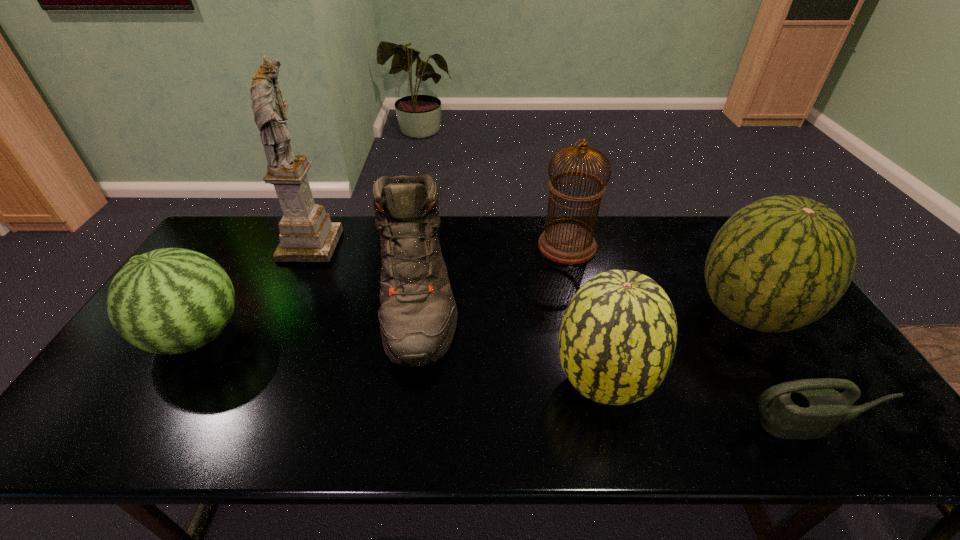
This screenshot has width=960, height=540. I want to click on sculpture, so click(306, 233).

You are a GUI agent. You are given a task and a screenshot of the screen. Output one action in this format:
    pyautogui.click(x=<x>, y=<y>)
    Task: Click on the birdcage
    The width and height of the screenshot is (960, 540).
    Given the screenshot: What is the action you would take?
    pyautogui.click(x=570, y=244)

The width and height of the screenshot is (960, 540). What are the coordinates of `ski boot` in the screenshot? It's located at (418, 315).

Locate an element on the screen. the rightmost watermelon is located at coordinates (782, 262).

Where is `the second watermelon from left to right`? the second watermelon from left to right is located at coordinates (617, 340).

Image resolution: width=960 pixels, height=540 pixels. Identify the location of the leftmost watermelon. point(172,300).

The height and width of the screenshot is (540, 960). I want to click on the shortest object, so click(x=809, y=408).

This screenshot has width=960, height=540. I want to click on vacant position located on the front-facing side of the tallest object, so click(x=372, y=245).

Identify the location of vacant space located on the front-facing side of the birdcage. The image size is (960, 540). (481, 246).

At what (x,y) coordinates should I click in order to perform the action: click on vacant position located 0.140m on the front-facing side of the birdcage. Please return your answer as a coordinate pair (x, y). The image size is (960, 540). Looking at the image, I should click on (496, 246).